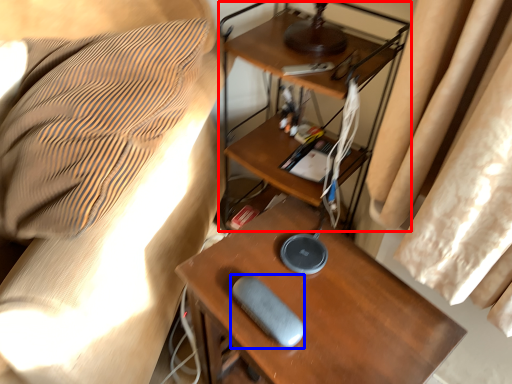
Question: Which point is further to the camera, computer desk (highlighted by a red box) or equipment (highlighted by a blue box)?

Choices:
 (A) computer desk
 (B) equipment

Answer: (A)